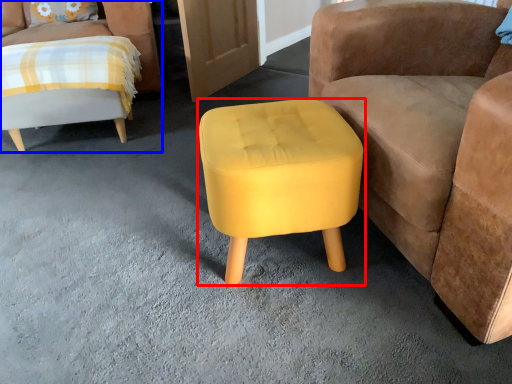
Question: Which object appears closest to the camera in this image, stool (highlighted by a red box) or chair (highlighted by a blue box)?

Choices:
 (A) stool
 (B) chair

Answer: (A)